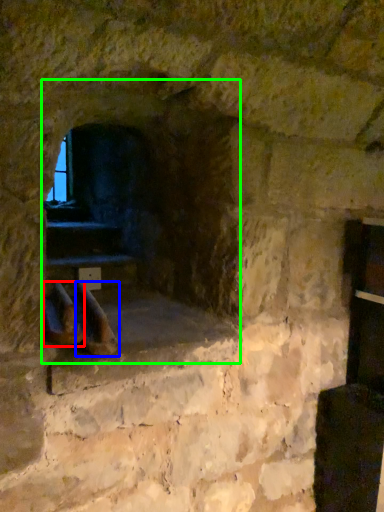
Question: Which is farther away from footwear (highlighted by a red box)? footwear (highlighted by a blue box) or fireplace (highlighted by a green box)?

Choices:
 (A) footwear
 (B) fireplace

Answer: (B)